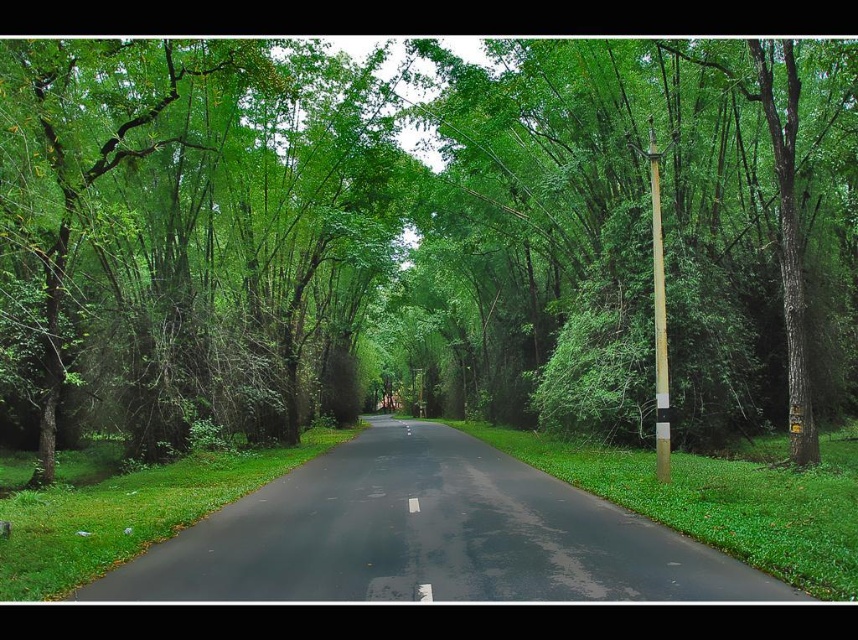
Question: Does black asphalt road at center appear over brown wooden pole at right?

Choices:
 (A) yes
 (B) no

Answer: (B)

Question: Where is green leafy tree at center located in relation to green leafy tree at left in the image?

Choices:
 (A) left
 (B) right

Answer: (B)

Question: Which point is farther from the camera taking this photo?

Choices:
 (A) (639, 582)
 (B) (59, 74)
 (C) (660, 346)
 (D) (325, 177)

Answer: (D)

Question: Among these points, which one is farthest from the camera?

Choices:
 (A) 764,227
 (B) 171,42
 (C) 467,595
 (D) 657,397

Answer: (A)

Question: Which point is farther to the camera?

Choices:
 (A) coord(310,340)
 (B) coord(659,195)
 (C) coord(559,516)

Answer: (A)

Question: Is green leafy tree at left below brown wooden pole at right?

Choices:
 (A) yes
 (B) no

Answer: (B)